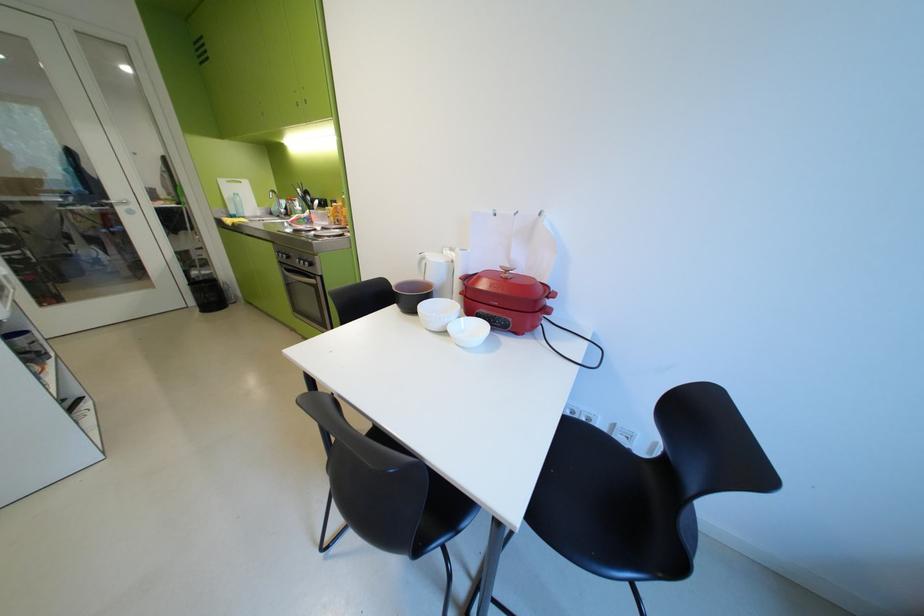
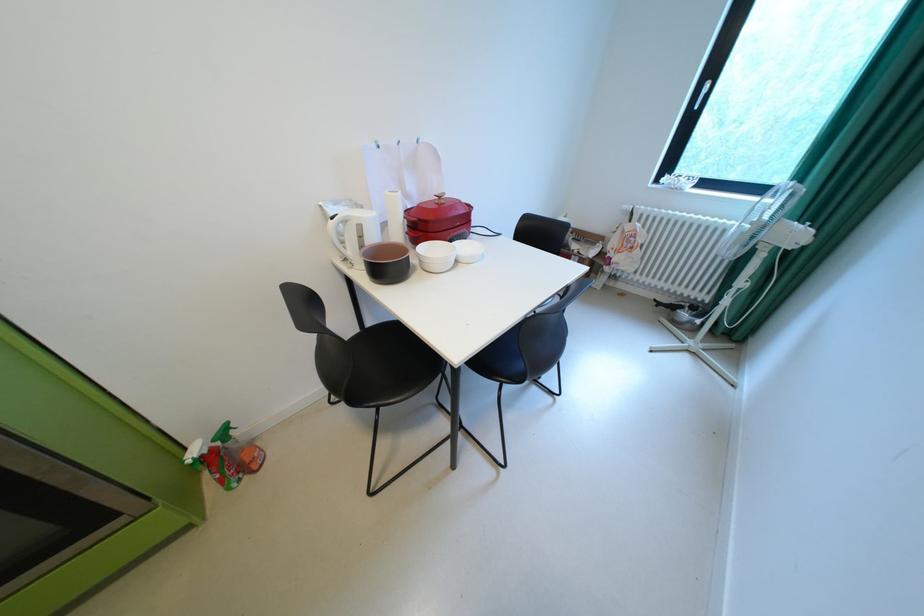
The point at (517,272) is marked in the first image. Where is the corresponding point in the second image?

(450, 198)